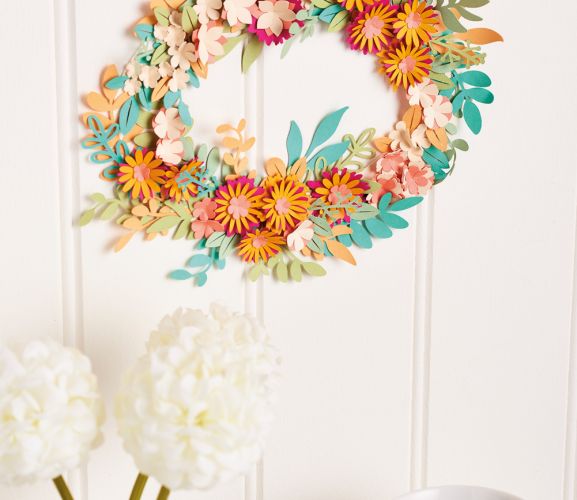
Identify the location of paper flowers. (288, 210), (347, 187), (277, 191), (163, 143).